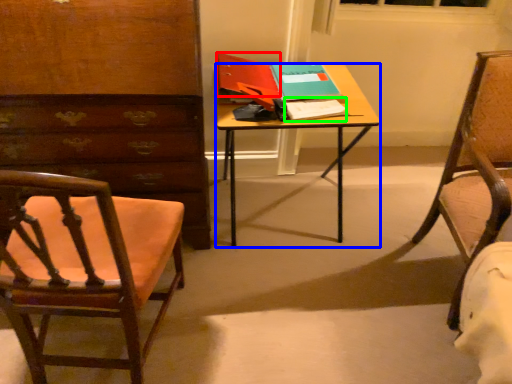
Question: Considering the real-world distances, which object is farthest from book (highlighted by a red box)? desk (highlighted by a blue box) or notepad (highlighted by a green box)?

Choices:
 (A) desk
 (B) notepad

Answer: (B)